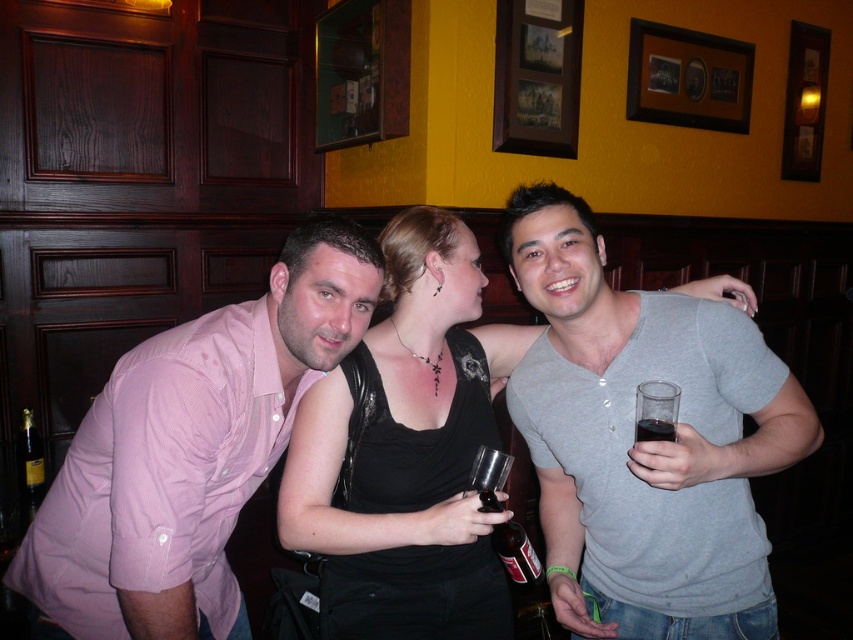
From the picture: You are a bartender at the bar and need to serve a customer. You see the gray cotton shirt at right and the dark glass at right. Which item is closer to you?

The gray cotton shirt at right is closer to you because it is in front of the dark glass at right.

You are a bartender who wants to place a new clear glass bottle at center closer to the black matte tank top at center. The minimum distance required between items on the bar is 6 inches. Is this adjustment possible without violating the spacing rule?

The black matte tank top at center and clear glass bottle at center are currently 9.33 inches apart. Moving the clear glass bottle at center closer to the black matte tank top at center would reduce the distance between them. Since the minimum required distance is 6 inches, you can move them as close as 6 inches apart while still complying with the spacing rule.